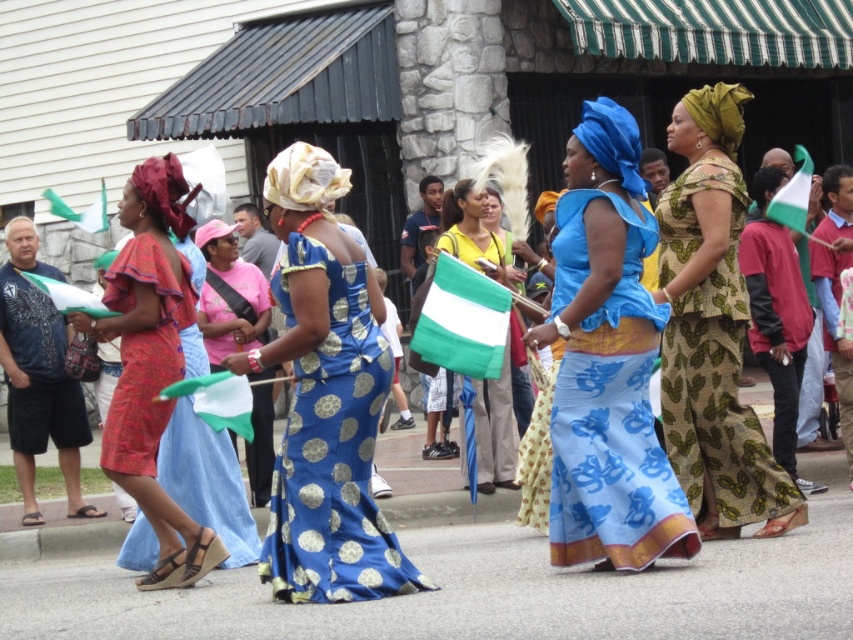
Question: Does blue printed dress at center lie in front of blue and gold fabric dress at center?

Choices:
 (A) no
 (B) yes

Answer: (B)

Question: Can you confirm if blue satin dress at center is positioned to the left of blue printed dress at center?

Choices:
 (A) no
 (B) yes

Answer: (A)

Question: Which object appears closest to the camera in this image?

Choices:
 (A) matte red dress at left
 (B) green and white fabric flag at center

Answer: (A)

Question: Does blue printed dress at center have a larger size compared to green and white fabric flag at center?

Choices:
 (A) yes
 (B) no

Answer: (A)

Question: Which point is closer to the camera?

Choices:
 (A) (476, 218)
 (B) (207, 236)
 (C) (575, 426)

Answer: (C)

Question: Which object is positioned closest to the matte red dress at left?

Choices:
 (A) blue satin dress at center
 (B) blue and gold fabric dress at center

Answer: (B)